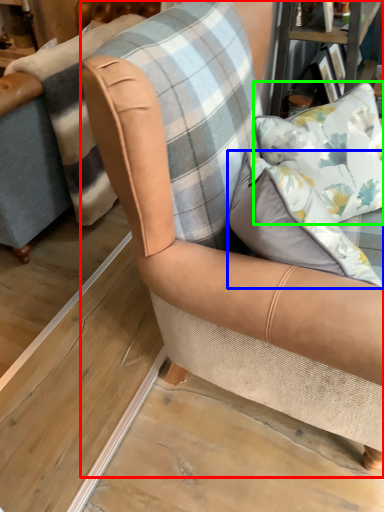
Question: Considering the real-world distances, which object is closest to chair (highlighted by a red box)? pillow (highlighted by a blue box) or pillow (highlighted by a green box).

Choices:
 (A) pillow
 (B) pillow

Answer: (A)